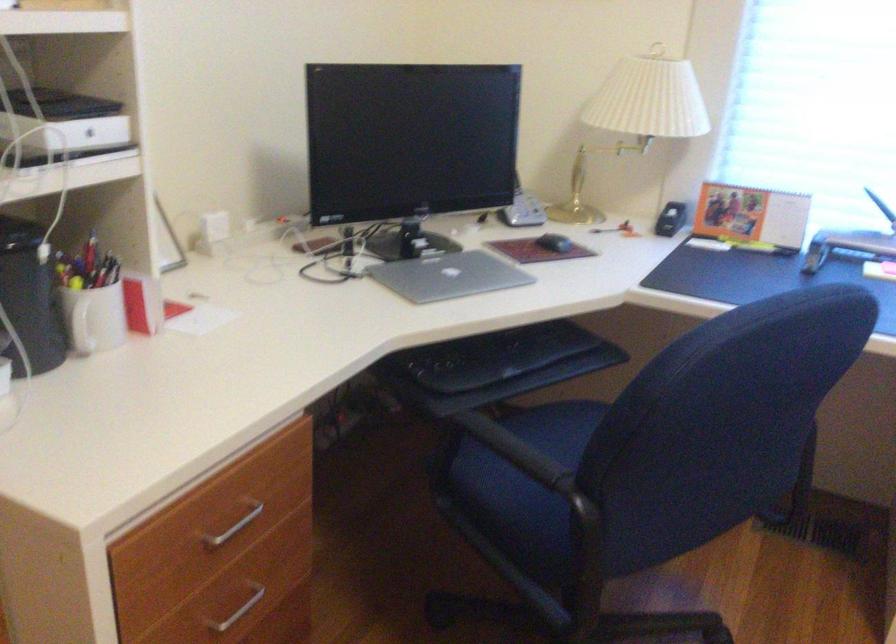
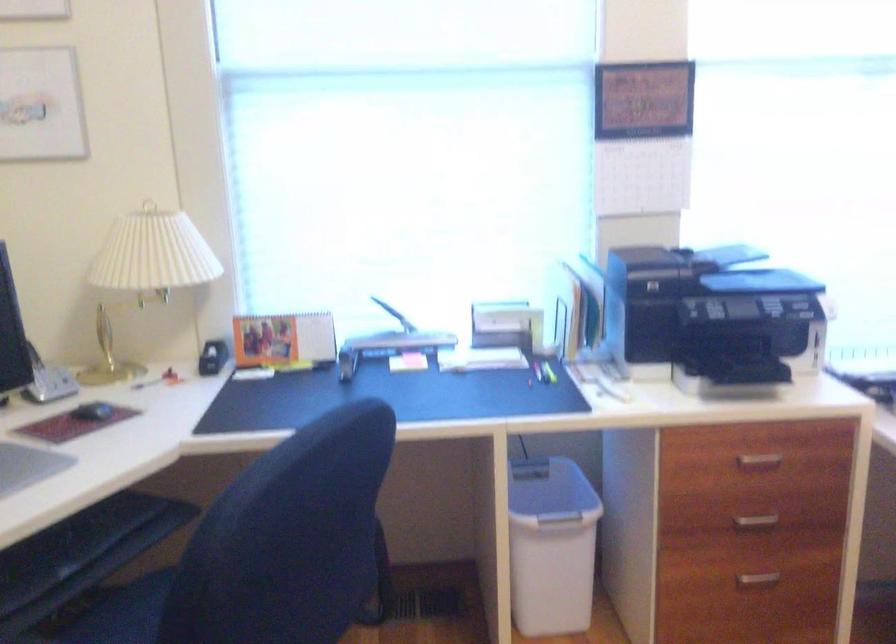
Question: How did the camera likely rotate?

Choices:
 (A) Left
 (B) Right
 (C) Up
 (D) Down

Answer: (B)